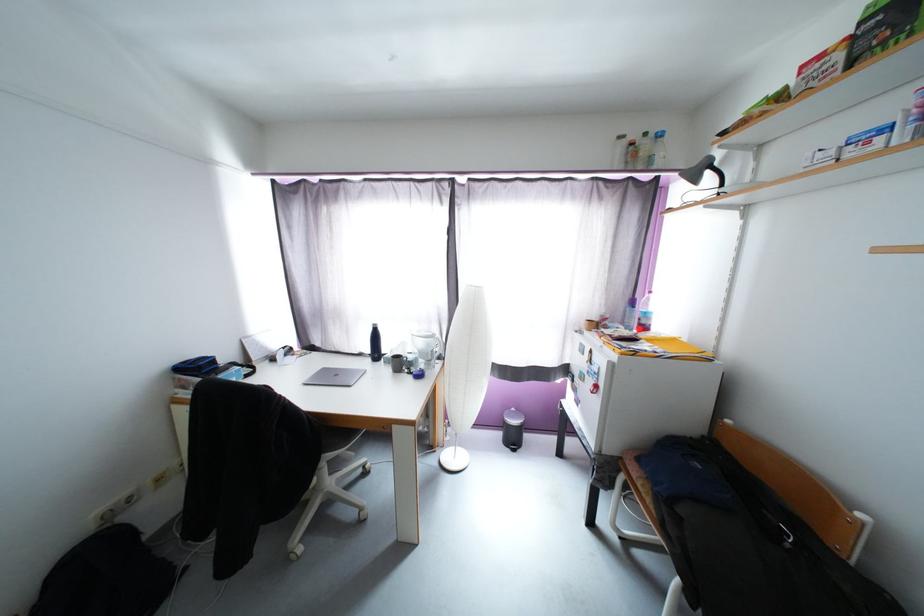
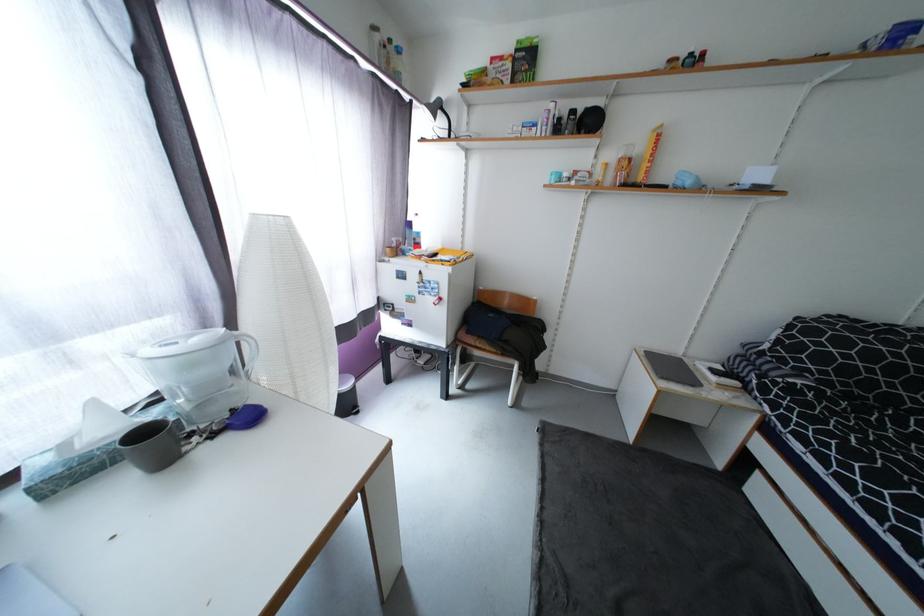
Find the pixel in the second image that matches the point at 653,501 in the first image.

(493, 349)